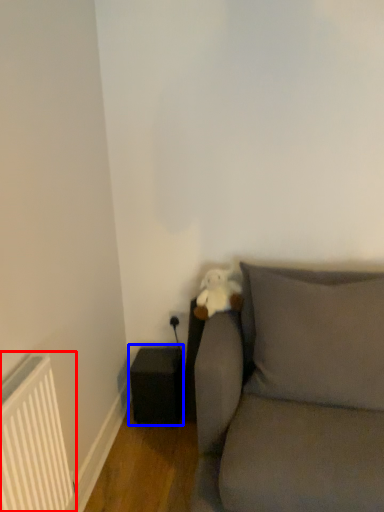
Question: Among these objects, which one is farthest to the camera, radiator (highlighted by a red box) or speaker (highlighted by a blue box)?

Choices:
 (A) radiator
 (B) speaker

Answer: (B)